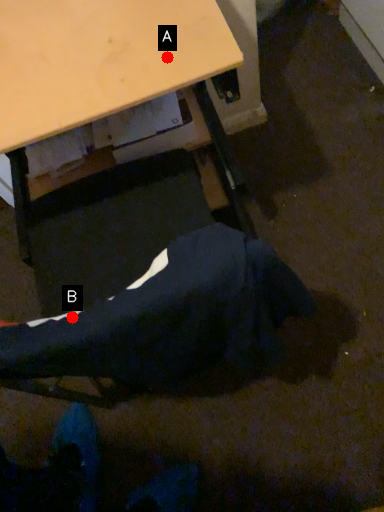
Question: Two points are circled on the image, labeled by A and B beside each circle. Which point is farther from the camera taking this photo?

Choices:
 (A) A is further
 (B) B is further

Answer: (A)